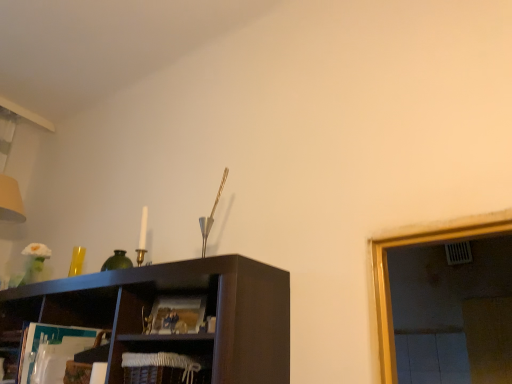
Image resolution: width=512 pixels, height=384 pixels. What do you see at coordinates (165, 360) in the screenshot?
I see `woven brown basket at lower center` at bounding box center [165, 360].

Locate an element on the screen. This screenshot has height=384, width=512. woven brown basket at lower center is located at coordinates (165, 360).

At what (x,y) coordinates should I click in order to perform the action: click on matte brown magazine at center. Please return your answer as a coordinate pair (x, y). The height and width of the screenshot is (384, 512). Looking at the image, I should click on (176, 315).

Describe the element at coordinates (176, 315) in the screenshot. I see `matte brown magazine at center` at that location.

Locate an element on the screen. The height and width of the screenshot is (384, 512). woven brown basket at lower center is located at coordinates (165, 360).

Is matte brown magazine at center at the left side of woven brown basket at lower center?

No, matte brown magazine at center is not to the left of woven brown basket at lower center.

Is matte brown magazine at center in front of woven brown basket at lower center?

No, matte brown magazine at center is behind woven brown basket at lower center.

Is point (167, 302) in front of point (177, 365)?

That is False.

From the image's perspective, is matte brown magazine at center located above woven brown basket at lower center?

Yes, from the image's perspective, matte brown magazine at center is on top of woven brown basket at lower center.

From a real-world perspective, is matte brown magazine at center located beneath woven brown basket at lower center?

Actually, matte brown magazine at center is physically above woven brown basket at lower center in the real world.

Is matte brown magazine at center wider than woven brown basket at lower center?

In fact, matte brown magazine at center might be narrower than woven brown basket at lower center.

Can you confirm if matte brown magazine at center is shorter than woven brown basket at lower center?

Yes, matte brown magazine at center is shorter than woven brown basket at lower center.

Looking at this image, can you confirm if matte brown magazine at center is bigger than woven brown basket at lower center?

No, matte brown magazine at center is not bigger than woven brown basket at lower center.

Is woven brown basket at lower center inside matte brown magazine at center?

No, woven brown basket at lower center is not surrounded by matte brown magazine at center.

Is matte brown magazine at center not close to woven brown basket at lower center?

No.

Is matte brown magazine at center looking in the opposite direction of woven brown basket at lower center?

matte brown magazine at center is not turned away from woven brown basket at lower center.

Can you tell me how much matte brown magazine at center and woven brown basket at lower center differ in facing direction?

The angular difference between matte brown magazine at center and woven brown basket at lower center is 23.5 degrees.

The width and height of the screenshot is (512, 384). What are the coordinates of `magazine that is behind the woven brown basket at lower center` in the screenshot? It's located at (176, 315).

Is woven brown basket at lower center to the left or to the right of matte brown magazine at center in the image?

woven brown basket at lower center is positioned on matte brown magazine at center's left side.

Does woven brown basket at lower center lie behind matte brown magazine at center?

No, it is not.

Considering the positions of points (194, 360) and (177, 310), is point (194, 360) farther from camera compared to point (177, 310)?

No, it is not.

From the image's perspective, is woven brown basket at lower center on matte brown magazine at center?

No, from the image's perspective, woven brown basket at lower center is not above matte brown magazine at center.

From a real-world perspective, between woven brown basket at lower center and matte brown magazine at center, who is vertically higher?

matte brown magazine at center is physically above.

Does woven brown basket at lower center have a greater width compared to matte brown magazine at center?

Indeed, woven brown basket at lower center has a greater width compared to matte brown magazine at center.

Between woven brown basket at lower center and matte brown magazine at center, which one has more height?

With more height is woven brown basket at lower center.

Considering the relative sizes of woven brown basket at lower center and matte brown magazine at center in the image provided, is woven brown basket at lower center smaller than matte brown magazine at center?

No.

Is matte brown magazine at center inside woven brown basket at lower center?

Definitely not — matte brown magazine at center is not inside woven brown basket at lower center.

Would you say woven brown basket at lower center is a long distance from matte brown magazine at center?

No, woven brown basket at lower center is not far from matte brown magazine at center.

Is woven brown basket at lower center oriented away from matte brown magazine at center?

That's not correct — woven brown basket at lower center is not looking away from matte brown magazine at center.

How many degrees apart are the facing directions of woven brown basket at lower center and matte brown magazine at center?

The angle between the facing direction of woven brown basket at lower center and the facing direction of matte brown magazine at center is 23.5 degrees.

Measure the distance from woven brown basket at lower center to matte brown magazine at center.

4.50 inches.

What are the coordinates of `magazine lying behind the woven brown basket at lower center` in the screenshot? It's located at (x=176, y=315).

The image size is (512, 384). I want to click on magazine above the woven brown basket at lower center (from the image's perspective), so click(176, 315).

Identify the location of cabinet that is below the matte brown magazine at center (from the image's perspective). Image resolution: width=512 pixels, height=384 pixels. (165, 360).